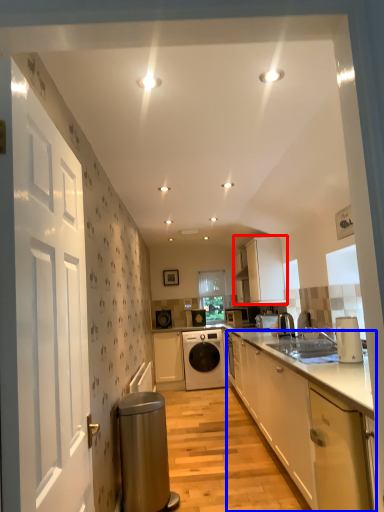
Question: Which object appears farthest to the camera in this image, cabinetry (highlighted by a red box) or cabinetry (highlighted by a blue box)?

Choices:
 (A) cabinetry
 (B) cabinetry

Answer: (A)